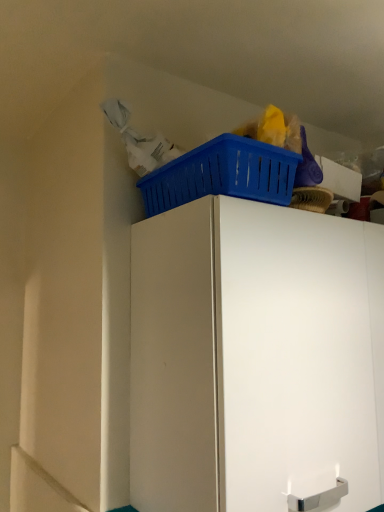
Question: Does blue plastic basket at upper right lie in front of white matte cabinet at upper center?

Choices:
 (A) yes
 (B) no

Answer: (B)

Question: Can you confirm if blue plastic basket at upper right is positioned to the left of white matte cabinet at upper center?

Choices:
 (A) yes
 (B) no

Answer: (A)

Question: Does blue plastic basket at upper right have a smaller size compared to white matte cabinet at upper center?

Choices:
 (A) yes
 (B) no

Answer: (A)

Question: Is blue plastic basket at upper right touching white matte cabinet at upper center?

Choices:
 (A) no
 (B) yes

Answer: (A)

Question: Is blue plastic basket at upper right not inside white matte cabinet at upper center?

Choices:
 (A) yes
 (B) no

Answer: (A)

Question: Considering the relative positions of blue plastic basket at upper right and white matte cabinet at upper center in the image provided, is blue plastic basket at upper right to the right of white matte cabinet at upper center from the viewer's perspective?

Choices:
 (A) yes
 (B) no

Answer: (B)

Question: Does white matte cabinet at upper center have a lesser height compared to blue plastic basket at upper right?

Choices:
 (A) yes
 (B) no

Answer: (B)

Question: Considering the relative sizes of white matte cabinet at upper center and blue plastic basket at upper right in the image provided, is white matte cabinet at upper center bigger than blue plastic basket at upper right?

Choices:
 (A) no
 (B) yes

Answer: (B)

Question: Considering the relative sizes of white matte cabinet at upper center and blue plastic basket at upper right in the image provided, is white matte cabinet at upper center wider than blue plastic basket at upper right?

Choices:
 (A) yes
 (B) no

Answer: (A)

Question: Is white matte cabinet at upper center to the left of blue plastic basket at upper right from the viewer's perspective?

Choices:
 (A) yes
 (B) no

Answer: (B)

Question: From the image's perspective, does white matte cabinet at upper center appear lower than blue plastic basket at upper right?

Choices:
 (A) no
 (B) yes

Answer: (B)

Question: Could you tell me if white matte cabinet at upper center is facing blue plastic basket at upper right?

Choices:
 (A) yes
 (B) no

Answer: (B)

Question: Is white matte cabinet at upper center in front of or behind blue plastic basket at upper right in the image?

Choices:
 (A) behind
 (B) front

Answer: (B)